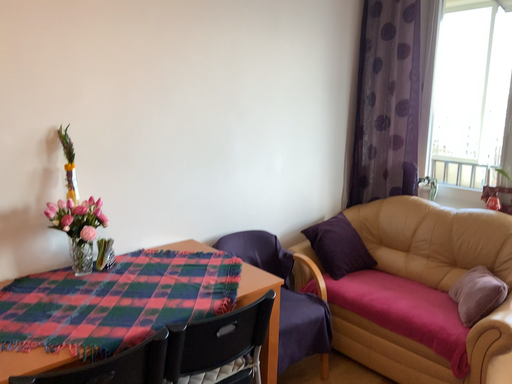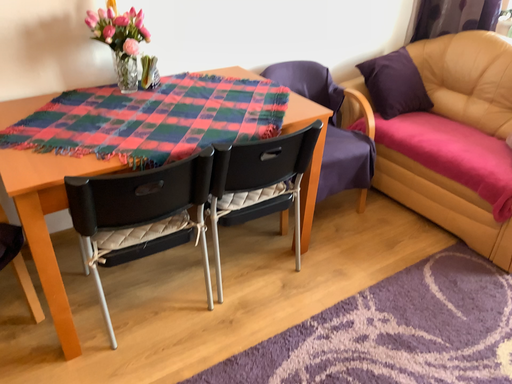
Question: Which way did the camera rotate in the video?

Choices:
 (A) rotated upward
 (B) rotated downward

Answer: (B)